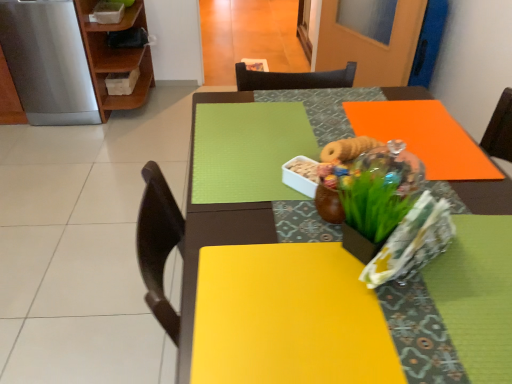
You are a GUI agent. You are given a task and a screenshot of the screen. Output one action in this format:
    pyautogui.click(x=<x>, y=<y>)
    Task: Click on the free spot below wooden shelf at upper left (from a real-world perspective)
    This screenshot has height=384, width=512.
    Given the screenshot: What is the action you would take?
    pyautogui.click(x=136, y=110)